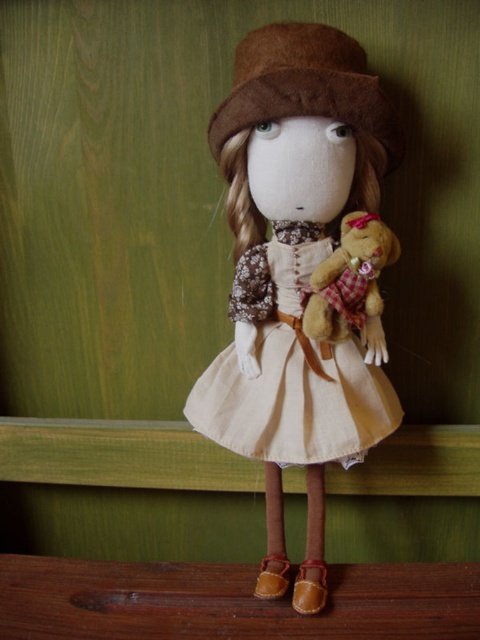
Question: Which object is positioned closest to the matte brown fabric doll at center?

Choices:
 (A) fluffy brown teddy bear at center
 (B) beige cotton dress at center

Answer: (B)

Question: Which of these objects is positioned farthest from the fluffy brown teddy bear at center?

Choices:
 (A) brown felt hat at center
 (B) beige cotton dress at center
 (C) matte brown fabric doll at center

Answer: (A)

Question: Is matte brown fabric doll at center wider than brown felt hat at center?

Choices:
 (A) no
 (B) yes

Answer: (B)

Question: Is the position of matte brown fabric doll at center less distant than that of brown felt hat at center?

Choices:
 (A) no
 (B) yes

Answer: (A)

Question: Is brown felt hat at center wider than fluffy brown teddy bear at center?

Choices:
 (A) yes
 (B) no

Answer: (A)

Question: Which object is farther from the camera taking this photo?

Choices:
 (A) matte brown fabric doll at center
 (B) brown felt hat at center
 (C) fluffy brown teddy bear at center
 (D) beige cotton dress at center

Answer: (D)